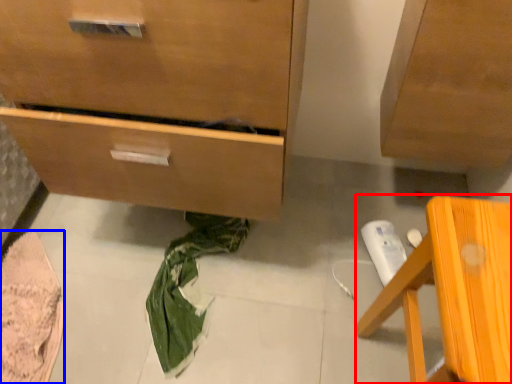
Question: Which of the following is the closest to the observer, furniture (highlighted by a red box) or material (highlighted by a blue box)?

Choices:
 (A) furniture
 (B) material

Answer: (A)